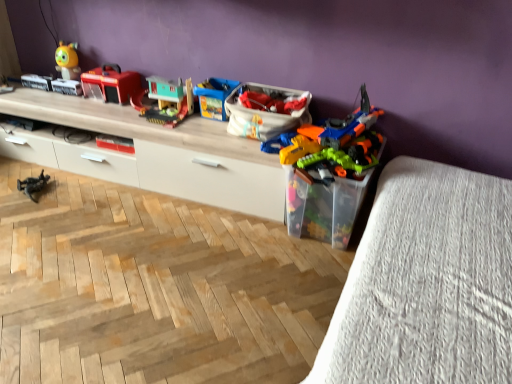
Describe the element at coordinates (164, 153) in the screenshot. I see `wooden at upper left` at that location.

The width and height of the screenshot is (512, 384). What are the coordinates of `translucent plastic storage box at center-right, acting as the 1th storage box starting from the bottom` in the screenshot? It's located at (324, 208).

Measure the distance between translucent plastic storage box at center-right, acting as the 1th storage box starting from the bottom, and camera.

translucent plastic storage box at center-right, acting as the 1th storage box starting from the bottom, and camera are 1.95 meters apart from each other.

Image resolution: width=512 pixels, height=384 pixels. Describe the element at coordinates (214, 97) in the screenshot. I see `blue plastic toy at center, which is counted as the 2th toy, starting from the right` at that location.

Where is `wooden at upper left`? wooden at upper left is located at coordinates (164, 153).

From the image's perspective, relative to wooden toy house at center, which is the 3th toy in right-to-left order, is translucent plastic storage box at center-right, acting as the 1th storage box starting from the bottom, above or below?

translucent plastic storage box at center-right, acting as the 1th storage box starting from the bottom, is situated lower than wooden toy house at center, which is the 3th toy in right-to-left order, in the image.

Based on the photo, does translucent plastic storage box at center-right, which is the 2th storage box from top to bottom, appear on the right side of wooden toy house at center, the 3th toy in the left-to-right sequence?

Yes.

Which is closer to the camera, (349,233) or (162,78)?

The point (349,233) is closer.

Is translucent plastic storage box at center-right, which is the 2th storage box from top to bottom, not close to wooden toy house at center, which is the 3th toy in right-to-left order?

No, translucent plastic storage box at center-right, which is the 2th storage box from top to bottom, is in close proximity to wooden toy house at center, which is the 3th toy in right-to-left order.

Is wooden at upper left bigger or smaller than wooden toy house at center, the 3th toy in the left-to-right sequence?

Clearly, wooden at upper left is larger in size than wooden toy house at center, the 3th toy in the left-to-right sequence.

In the image, there is a wooden toy house at center, the 3th toy in the left-to-right sequence. Identify the location of shelf below it (from a real-world perspective). pos(164,153).

From the image's perspective, is wooden at upper left beneath wooden toy house at center, the 3th toy in the left-to-right sequence?

Indeed, from the image's perspective, wooden at upper left is shown beneath wooden toy house at center, the 3th toy in the left-to-right sequence.

Is wooden at upper left far away from wooden toy house at center, the 3th toy in the left-to-right sequence?

No, wooden at upper left is not far from wooden toy house at center, the 3th toy in the left-to-right sequence.

Where is `the 4th toy to the right of the metallic gray toy soldier at lower left, the fifth toy in the right-to-left sequence, counting from the anchor's position`? This screenshot has width=512, height=384. the 4th toy to the right of the metallic gray toy soldier at lower left, the fifth toy in the right-to-left sequence, counting from the anchor's position is located at coordinates (332, 146).

From the image's perspective, is metallic gray toy soldier at lower left, the fifth toy in the right-to-left sequence, on translucent plastic toy guns at right, which ranks as the 1th toy in right-to-left order?

No, from the image's perspective, metallic gray toy soldier at lower left, the fifth toy in the right-to-left sequence, is not above translucent plastic toy guns at right, which ranks as the 1th toy in right-to-left order.

From a real-world perspective, is metallic gray toy soldier at lower left, marked as the 1th toy in a left-to-right arrangement, under translucent plastic toy guns at right, the 5th toy positioned from the left?

Yes.

Would you say metallic gray toy soldier at lower left, the fifth toy in the right-to-left sequence, is inside or outside translucent plastic toy guns at right, which ranks as the 1th toy in right-to-left order?

metallic gray toy soldier at lower left, the fifth toy in the right-to-left sequence, cannot be found inside translucent plastic toy guns at right, which ranks as the 1th toy in right-to-left order.

Is point (109, 65) closer to camera compared to point (417, 290)?

That is False.

Would you say shiny red fire truck at center, the 4th toy when ordered from right to left, contains translucent plastic toy container at lower right?

No, shiny red fire truck at center, the 4th toy when ordered from right to left, does not contain translucent plastic toy container at lower right.

Which object is further away from the camera, shiny red fire truck at center, the 2th toy in the left-to-right sequence, or translucent plastic toy container at lower right?

shiny red fire truck at center, the 2th toy in the left-to-right sequence, is further away from the camera.

In the scene shown: From a real-world perspective, is shiny red fire truck at center, the 4th toy when ordered from right to left, positioned over translucent plastic toy container at lower right based on gravity?

Indeed, from a real-world perspective, shiny red fire truck at center, the 4th toy when ordered from right to left, stands above translucent plastic toy container at lower right.

From a real-world perspective, who is located higher, white fabric bag at center, the 2th storage box when ordered from bottom to top, or metallic gray toy soldier at lower left, the fifth toy in the right-to-left sequence?

From a 3D spatial view, white fabric bag at center, the 2th storage box when ordered from bottom to top, is above.

Does white fabric bag at center, positioned as the 1th storage box in top-to-bottom order, turn towards metallic gray toy soldier at lower left, the fifth toy in the right-to-left sequence?

No, white fabric bag at center, positioned as the 1th storage box in top-to-bottom order, is not turned towards metallic gray toy soldier at lower left, the fifth toy in the right-to-left sequence.

Can you confirm if white fabric bag at center, the 2th storage box when ordered from bottom to top, is positioned to the left of metallic gray toy soldier at lower left, the fifth toy in the right-to-left sequence?

No, white fabric bag at center, the 2th storage box when ordered from bottom to top, is not to the left of metallic gray toy soldier at lower left, the fifth toy in the right-to-left sequence.

Is point (268, 95) behind point (295, 143)?

Yes, it is.

In the scene shown: Is white fabric bag at center, the 2th storage box when ordered from bottom to top, not inside translucent plastic toy guns at right, which ranks as the 1th toy in right-to-left order?

No, white fabric bag at center, the 2th storage box when ordered from bottom to top, is not outside of translucent plastic toy guns at right, which ranks as the 1th toy in right-to-left order.

Considering the relative sizes of white fabric bag at center, positioned as the 1th storage box in top-to-bottom order, and translucent plastic toy guns at right, which ranks as the 1th toy in right-to-left order, in the image provided, is white fabric bag at center, positioned as the 1th storage box in top-to-bottom order, thinner than translucent plastic toy guns at right, which ranks as the 1th toy in right-to-left order,?

Yes.

Considering the sizes of wooden at upper left and blue plastic toy at center, which is counted as the 2th toy, starting from the right, in the image, is wooden at upper left wider or thinner than blue plastic toy at center, which is counted as the 2th toy, starting from the right,?

Considering their sizes, wooden at upper left looks broader than blue plastic toy at center, which is counted as the 2th toy, starting from the right.

Where is `shelf in front of the blue plastic toy at center, which is counted as the 2th toy, starting from the right`? Image resolution: width=512 pixels, height=384 pixels. shelf in front of the blue plastic toy at center, which is counted as the 2th toy, starting from the right is located at coordinates (164, 153).

Looking at this image, does wooden at upper left lie behind blue plastic toy at center, which is counted as the 2th toy, starting from the right?

No, the depth of wooden at upper left is less than that of blue plastic toy at center, which is counted as the 2th toy, starting from the right.

From the picture: Is wooden at upper left to the left or to the right of blue plastic toy at center, which is the fourth toy from left to right, in the image?

wooden at upper left is to the left of blue plastic toy at center, which is the fourth toy from left to right.

At what (x,y) coordinates should I click in order to perform the action: click on toy that is the 1st one when counting backward from the translucent plastic storage box at center-right, acting as the 1th storage box starting from the bottom. Please return your answer as a coordinate pair (x, y). Looking at the image, I should click on (165, 101).

Identify the location of shelf beneath the wooden toy house at center, the 3th toy in the left-to-right sequence (from a real-world perspective). (164, 153).

Estimate the real-world distances between objects in this image. Which object is closer to shiny red fire truck at center, the 2th toy in the left-to-right sequence, metallic gray toy soldier at lower left, the fifth toy in the right-to-left sequence, or blue plastic toy at center, which is the fourth toy from left to right?

blue plastic toy at center, which is the fourth toy from left to right, lies closer to shiny red fire truck at center, the 2th toy in the left-to-right sequence, than the other object.

When comparing their distances from wooden toy house at center, which is the 3th toy in right-to-left order, does metallic gray toy soldier at lower left, the fifth toy in the right-to-left sequence, or translucent plastic toy container at lower right seem further?

The object further to wooden toy house at center, which is the 3th toy in right-to-left order, is translucent plastic toy container at lower right.

Based on their spatial positions, is blue plastic toy at center, which is counted as the 2th toy, starting from the right, or wooden at upper left further from wooden toy house at center, the 3th toy in the left-to-right sequence?

wooden at upper left.

Based on the photo, which object lies nearer to the anchor point white fabric bag at center, the 2th storage box when ordered from bottom to top, wooden at upper left or translucent plastic toy container at lower right?

wooden at upper left is positioned closer to the anchor white fabric bag at center, the 2th storage box when ordered from bottom to top.

Considering their positions, is metallic gray toy soldier at lower left, the fifth toy in the right-to-left sequence, positioned closer to white fabric bag at center, the 2th storage box when ordered from bottom to top, than shiny red fire truck at center, the 2th toy in the left-to-right sequence?

shiny red fire truck at center, the 2th toy in the left-to-right sequence, lies closer to white fabric bag at center, the 2th storage box when ordered from bottom to top, than the other object.

Considering their positions, is wooden at upper left positioned closer to translucent plastic storage box at center-right, acting as the 1th storage box starting from the bottom, than shiny red fire truck at center, the 2th toy in the left-to-right sequence?

wooden at upper left is positioned closer to the anchor translucent plastic storage box at center-right, acting as the 1th storage box starting from the bottom.

Considering their positions, is translucent plastic toy guns at right, the 5th toy positioned from the left, positioned further to white fabric bag at center, the 2th storage box when ordered from bottom to top, than metallic gray toy soldier at lower left, the fifth toy in the right-to-left sequence?

metallic gray toy soldier at lower left, the fifth toy in the right-to-left sequence.

Estimate the real-world distances between objects in this image. Which object is further from translucent plastic storage box at center-right, acting as the 1th storage box starting from the bottom, translucent plastic toy container at lower right or shiny red fire truck at center, the 4th toy when ordered from right to left?

Answer: shiny red fire truck at center, the 4th toy when ordered from right to left, is positioned further to the anchor translucent plastic storage box at center-right, acting as the 1th storage box starting from the bottom.

This screenshot has height=384, width=512. I want to click on storage box between blue plastic toy at center, which is the fourth toy from left to right, and translucent plastic storage box at center-right, acting as the 1th storage box starting from the bottom, so click(x=266, y=110).

The width and height of the screenshot is (512, 384). Find the location of `storage box located between shiny red fire truck at center, the 4th toy when ordered from right to left, and translucent plastic toy guns at right, the 5th toy positioned from the left, in the left-right direction`. storage box located between shiny red fire truck at center, the 4th toy when ordered from right to left, and translucent plastic toy guns at right, the 5th toy positioned from the left, in the left-right direction is located at coordinates (266, 110).

At what (x,y) coordinates should I click in order to perform the action: click on shelf between metallic gray toy soldier at lower left, the fifth toy in the right-to-left sequence, and wooden toy house at center, which is the 3th toy in right-to-left order, from left to right. Please return your answer as a coordinate pair (x, y). The width and height of the screenshot is (512, 384). Looking at the image, I should click on (164, 153).

Where is `storage box between wooden toy house at center, which is the 3th toy in right-to-left order, and translucent plastic storage box at center-right, acting as the 1th storage box starting from the bottom, in the horizontal direction`? storage box between wooden toy house at center, which is the 3th toy in right-to-left order, and translucent plastic storage box at center-right, acting as the 1th storage box starting from the bottom, in the horizontal direction is located at coordinates (266, 110).